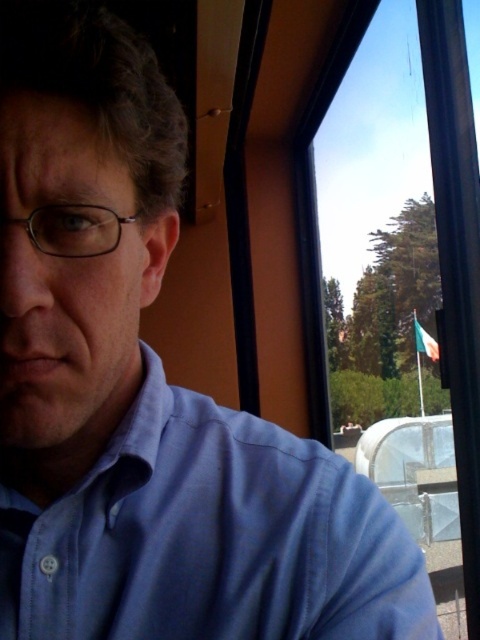
Can you confirm if blue cotton dress shirt at upper left is positioned to the right of transparent glass window at upper right?

No, blue cotton dress shirt at upper left is not to the right of transparent glass window at upper right.

Does blue cotton dress shirt at upper left have a smaller size compared to transparent glass window at upper right?

Indeed, blue cotton dress shirt at upper left has a smaller size compared to transparent glass window at upper right.

Is point (295, 460) positioned behind point (470, 320)?

No, (295, 460) is closer to viewer.

Locate an element on the screen. blue cotton dress shirt at upper left is located at coordinates (210, 538).